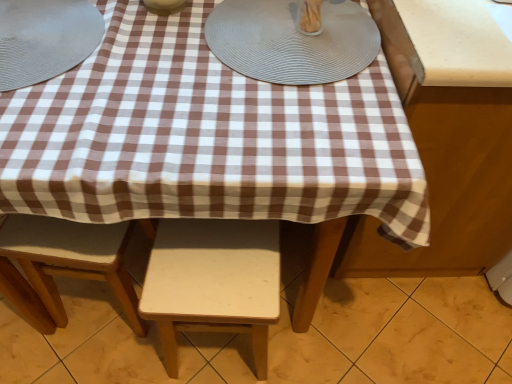
In order to click on vacant space situated above white matte stool at center, arranged as the first stool when viewed from the right (from a real-world perspective) in this screenshot , I will do `click(216, 262)`.